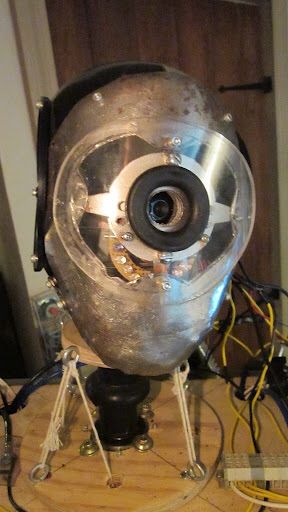
Locate an element on the screen. light grey molding is located at coordinates click(x=22, y=158).